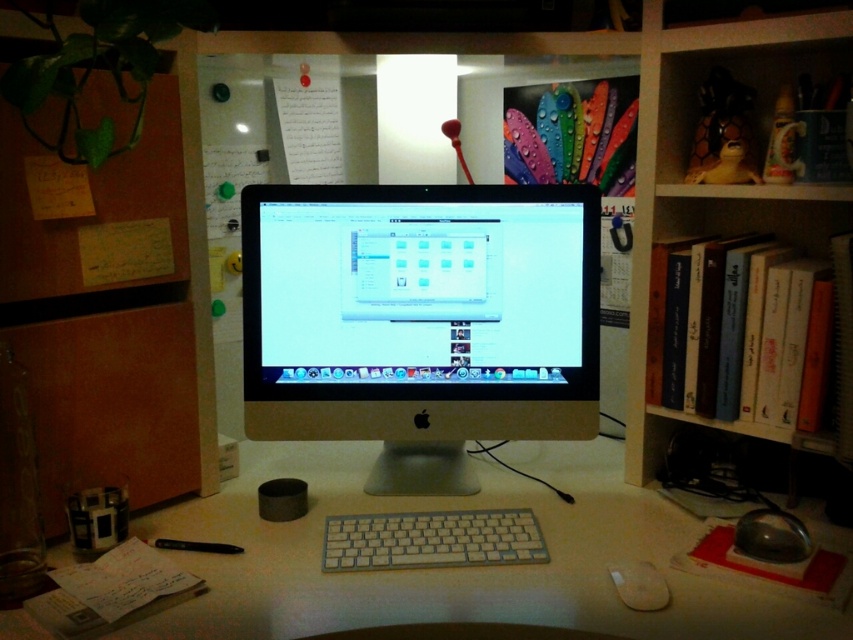
You are organizing a bookshelf and need to place the hardcover books at right and the burlap paper at left. Given their sizes, which one should you place first to ensure they both fit on the shelf?

Since the hardcover books at right is bigger than the burlap paper at left, you should place the hardcover books at right first to ensure there is enough space for both items on the shelf.

You have a desk organizer that is 10 inches wide. You want to place both the satin gold monitor at center and the white matte mouse at lower right on it. Can both items fit side by side?

The satin gold monitor at center might be wider than the white matte mouse at lower right, so it is uncertain if both can fit side by side on the desk organizer that is 10 inches wide without overlapping.

You are organizing items in the workspace and need to place a new object between the hardcover books at right and the burlap paper at left. Which item should you place closer to you to ensure the new object is between them?

You should place the new object closer to the burlap paper at left because the hardcover books at right are further away from you than the burlap paper at left, so positioning the object near the closer item ensures it is between them.